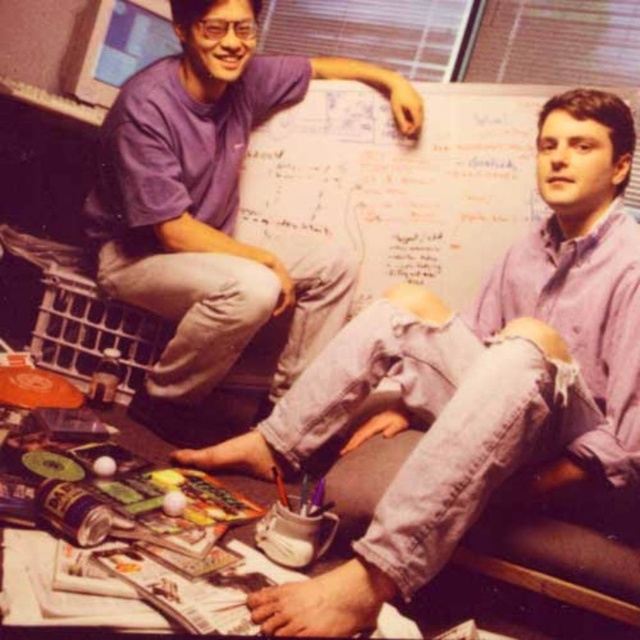
Question: Which point is farther to the camera?

Choices:
 (A) denim jeans at center
 (B) purple cotton shirt at upper left

Answer: (B)

Question: Does denim jeans at center have a smaller size compared to purple cotton shirt at upper left?

Choices:
 (A) no
 (B) yes

Answer: (A)

Question: Is denim jeans at center to the right of purple cotton shirt at upper left from the viewer's perspective?

Choices:
 (A) yes
 (B) no

Answer: (A)

Question: Does denim jeans at center appear over purple cotton shirt at upper left?

Choices:
 (A) no
 (B) yes

Answer: (A)